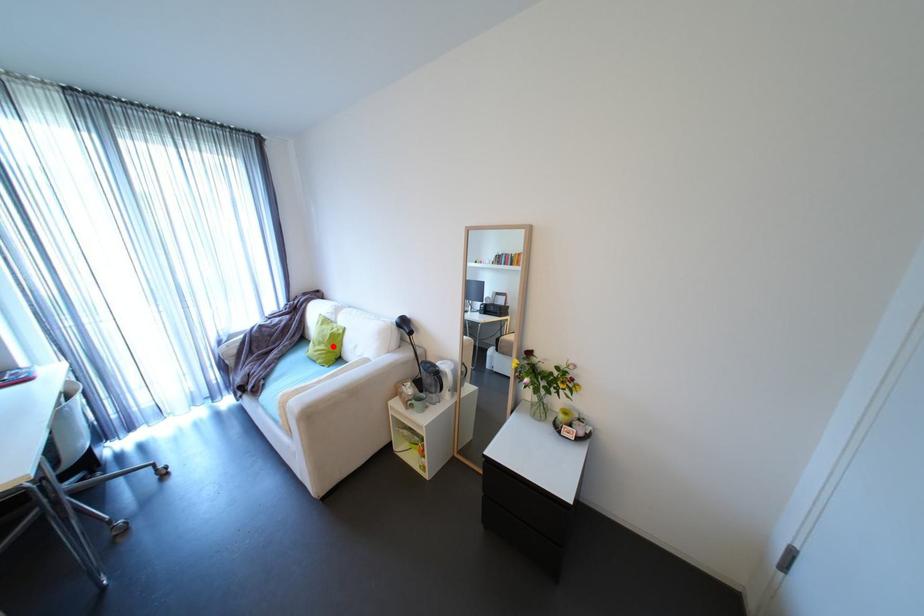
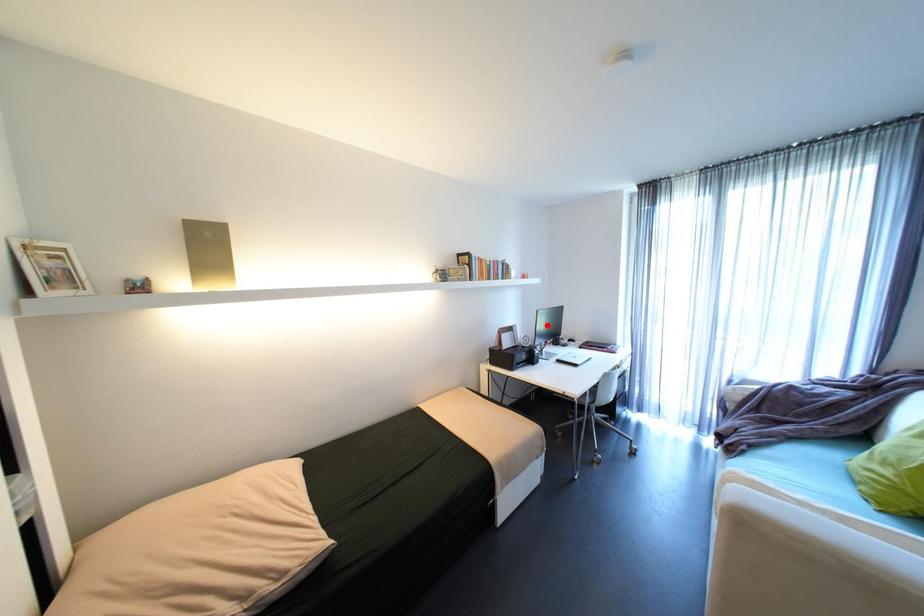
I am providing you with two images of the same scene from different viewpoints. A red point is marked on the first image and another point is marked on the second image. Does the point marked in image1 correspond to the same location as the one in image2?

No